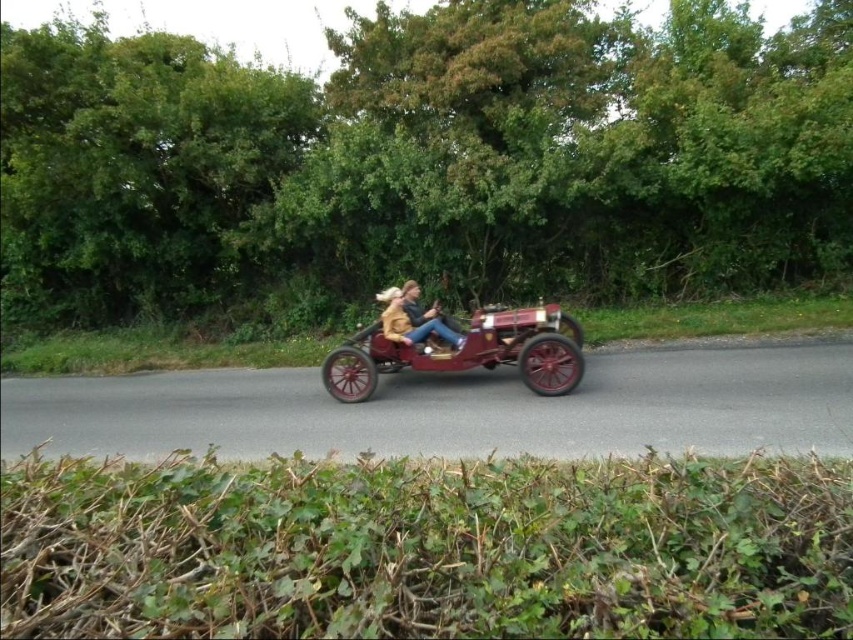
You are a passenger in the vintage car and want to place a small bag on the maroon polished wood sidecar at center. The coordinates given are point A at (466,353). Is this point on the sidecar?

Yes, the point A at (466,353) is on the maroon polished wood sidecar at center, so you can place your bag there.

You are a passenger in the vintage car and need to place your leather jacket at center on the maroon polished wood sidecar at center. Can you do this without folding the jacket?

The maroon polished wood sidecar at center is taller than the leather jacket at center, so yes, you can place the leather jacket at center on the maroon polished wood sidecar at center without folding it.

You are a passenger in the vintage car and want to place your leather jacket at center on the maroon polished wood sidecar at center. Can you reach it without getting out of the car?

The maroon polished wood sidecar at center is closer to the viewer than the leather jacket at center, so you can easily reach the leather jacket at center and place it on the maroon polished wood sidecar at center without needing to exit the car.